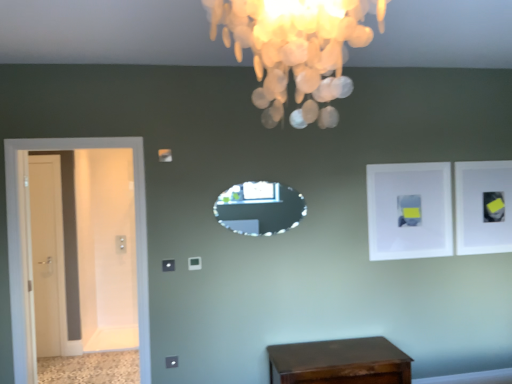
Measure the distance between crystal glass mirror at center and camera.

The distance of crystal glass mirror at center from camera is 10.09 feet.

Locate an element on the screen. The image size is (512, 384). crystal glass mirror at center is located at coordinates (260, 208).

The height and width of the screenshot is (384, 512). What do you see at coordinates (23, 235) in the screenshot?
I see `white glossy door at left, which appears as the first door when viewed from the right` at bounding box center [23, 235].

Where is `white matte picture frame at upper right, which is counted as the 1th picture frame, starting from the front`? This screenshot has width=512, height=384. white matte picture frame at upper right, which is counted as the 1th picture frame, starting from the front is located at coordinates (409, 210).

Where is `crystal glass mirror at center`? crystal glass mirror at center is located at coordinates (260, 208).

From the image's perspective, does ivory shell chandelier at upper center appear lower than white matte picture frame at upper right, placed as the 2th picture frame when sorted from right to left?

Incorrect, from the image's perspective, ivory shell chandelier at upper center is higher than white matte picture frame at upper right, placed as the 2th picture frame when sorted from right to left.

Between ivory shell chandelier at upper center and white matte picture frame at upper right, placed as the 2th picture frame when sorted from right to left, which one has more height?

With more height is white matte picture frame at upper right, placed as the 2th picture frame when sorted from right to left.

Measure the distance from ivory shell chandelier at upper center to white matte picture frame at upper right, placed as the 2th picture frame when sorted from right to left.

ivory shell chandelier at upper center is 2.46 meters away from white matte picture frame at upper right, placed as the 2th picture frame when sorted from right to left.

In the scene shown: Is ivory shell chandelier at upper center aimed at white matte picture frame at upper right, arranged as the 2th picture frame when viewed from the back?

No, ivory shell chandelier at upper center is not turned towards white matte picture frame at upper right, arranged as the 2th picture frame when viewed from the back.

Considering the relative sizes of white glossy door at left, which is counted as the second door, starting from the back, and white matte picture frame at upper right, which appears as the first picture frame when viewed from the left, in the image provided, is white glossy door at left, which is counted as the second door, starting from the back, taller than white matte picture frame at upper right, which appears as the first picture frame when viewed from the left,?

Yes.

Where is `door in front of the white matte picture frame at upper right, arranged as the 2th picture frame when viewed from the back`? door in front of the white matte picture frame at upper right, arranged as the 2th picture frame when viewed from the back is located at coordinates (23, 235).

Is white glossy door at left, which is counted as the first door, starting from the front, wider or thinner than white matte picture frame at upper right, which appears as the first picture frame when viewed from the left?

Considering their sizes, white glossy door at left, which is counted as the first door, starting from the front, looks broader than white matte picture frame at upper right, which appears as the first picture frame when viewed from the left.

Is white glossy door at left, which is counted as the first door, starting from the front, wider or thinner than white matte picture frame at upper right, which is the first picture frame from back to front?

Considering their sizes, white glossy door at left, which is counted as the first door, starting from the front, looks broader than white matte picture frame at upper right, which is the first picture frame from back to front.

Does point (12, 146) appear closer or farther from the camera than point (511, 230)?

Point (12, 146).

Looking at this image, which of these two, white glossy door at left, which appears as the first door when viewed from the right, or white matte picture frame at upper right, which is the 1th picture frame in right-to-left order, is bigger?

With larger size is white glossy door at left, which appears as the first door when viewed from the right.

Based on their positions, is white glossy door at left, the second door positioned from the left, located to the left or right of white matte picture frame at upper right, which is the 1th picture frame in right-to-left order?

From the image, it's evident that white glossy door at left, the second door positioned from the left, is to the left of white matte picture frame at upper right, which is the 1th picture frame in right-to-left order.

How far apart are shiny brown wooden table at lower center and white glossy door at left, the second door positioned from the left?

shiny brown wooden table at lower center and white glossy door at left, the second door positioned from the left, are 1.42 meters apart.

Can you confirm if shiny brown wooden table at lower center is wider than white glossy door at left, which is counted as the first door, starting from the front?

Yes, shiny brown wooden table at lower center is wider than white glossy door at left, which is counted as the first door, starting from the front.

Considering the relative positions of shiny brown wooden table at lower center and white glossy door at left, which appears as the first door when viewed from the right, in the image provided, is shiny brown wooden table at lower center to the left or to the right of white glossy door at left, which appears as the first door when viewed from the right,?

Based on their positions, shiny brown wooden table at lower center is located to the right of white glossy door at left, which appears as the first door when viewed from the right.

From the image's perspective, is shiny brown wooden table at lower center located above or below white glossy door at left, which appears as the first door when viewed from the right?

Based on their image positions, shiny brown wooden table at lower center is located beneath white glossy door at left, which appears as the first door when viewed from the right.

Which point is more forward, (6,195) or (322,59)?

The point (322,59) is more forward.

How many degrees apart are the facing directions of white glossy door at left, which is counted as the second door, starting from the back, and ivory shell chandelier at upper center?

They differ by 87.8 degrees in their facing directions.

Which is behind, white glossy door at left, which is counted as the first door, starting from the front, or ivory shell chandelier at upper center?

white glossy door at left, which is counted as the first door, starting from the front, is further away from the camera.

Considering the sizes of objects white glossy door at left, which appears as the first door when viewed from the right, and ivory shell chandelier at upper center in the image provided, who is bigger, white glossy door at left, which appears as the first door when viewed from the right, or ivory shell chandelier at upper center?

white glossy door at left, which appears as the first door when viewed from the right.

From the image's perspective, is ivory shell chandelier at upper center on shiny brown wooden table at lower center?

Yes, from the image's perspective, ivory shell chandelier at upper center is over shiny brown wooden table at lower center.

Locate an element on the screen. The height and width of the screenshot is (384, 512). lamp above the shiny brown wooden table at lower center (from the image's perspective) is located at coordinates (296, 50).

Is ivory shell chandelier at upper center positioned beyond the bounds of shiny brown wooden table at lower center?

That's correct, ivory shell chandelier at upper center is outside of shiny brown wooden table at lower center.

Based on the photo, from a real-world perspective, which is physically above, ivory shell chandelier at upper center or shiny brown wooden table at lower center?

From a 3D spatial view, ivory shell chandelier at upper center is above.

Based on the photo, how many degrees apart are the facing directions of white matte picture frame at upper right, which is the 1th picture frame in right-to-left order, and white glossy door at left, which appears as the first door when viewed from the right?

0.445 degrees.

Is white matte picture frame at upper right, which is the 1th picture frame in right-to-left order, not near white glossy door at left, the second door positioned from the left?

Absolutely, white matte picture frame at upper right, which is the 1th picture frame in right-to-left order, is distant from white glossy door at left, the second door positioned from the left.

Is white matte picture frame at upper right, which is the 1th picture frame in right-to-left order, positioned before white glossy door at left, which appears as the first door when viewed from the right?

No, white matte picture frame at upper right, which is the 1th picture frame in right-to-left order, is behind white glossy door at left, which appears as the first door when viewed from the right.

Between white matte picture frame at upper right, placed as the second picture frame when sorted from left to right, and white glossy door at left, which appears as the first door when viewed from the right, which one has smaller size?

white matte picture frame at upper right, placed as the second picture frame when sorted from left to right, is smaller.

The width and height of the screenshot is (512, 384). In order to click on lamp in front of the white matte picture frame at upper right, which appears as the first picture frame when viewed from the left in this screenshot , I will do `click(296, 50)`.

The image size is (512, 384). I want to click on door that is the 1st object to the left of the white matte picture frame at upper right, arranged as the 2th picture frame when viewed from the back, starting at the anchor, so click(x=23, y=235).

Looking at this image, considering their positions, is white glossy door at left, acting as the first door starting from the back, positioned closer to white matte picture frame at upper right, which is the 1th picture frame in right-to-left order, than shiny brown wooden table at lower center?

Based on the image, shiny brown wooden table at lower center appears to be nearer to white matte picture frame at upper right, which is the 1th picture frame in right-to-left order.

From the image, which object appears to be farther from ivory shell chandelier at upper center, white matte picture frame at upper right, placed as the second picture frame when sorted from left to right, or white glossy door at left, acting as the first door starting from the back?

white glossy door at left, acting as the first door starting from the back, lies further to ivory shell chandelier at upper center than the other object.

Based on the photo, considering their positions, is white matte picture frame at upper right, which is the 2th picture frame in front-to-back order, positioned further to shiny brown wooden table at lower center than crystal glass mirror at center?

white matte picture frame at upper right, which is the 2th picture frame in front-to-back order, lies further to shiny brown wooden table at lower center than the other object.

When comparing their distances from white glossy door at left, the second door in the right-to-left sequence, does ivory shell chandelier at upper center or white matte picture frame at upper right, which appears as the first picture frame when viewed from the left, seem closer?

The object closer to white glossy door at left, the second door in the right-to-left sequence, is white matte picture frame at upper right, which appears as the first picture frame when viewed from the left.

Based on their spatial positions, is shiny brown wooden table at lower center or crystal glass mirror at center further from white matte picture frame at upper right, which is the 1th picture frame in right-to-left order?

crystal glass mirror at center lies further to white matte picture frame at upper right, which is the 1th picture frame in right-to-left order, than the other object.

Based on their spatial positions, is white glossy door at left, marked as the second door in a front-to-back arrangement, or crystal glass mirror at center further from ivory shell chandelier at upper center?

white glossy door at left, marked as the second door in a front-to-back arrangement, lies further to ivory shell chandelier at upper center than the other object.

From the image, which object appears to be nearer to ivory shell chandelier at upper center, crystal glass mirror at center or white matte picture frame at upper right, which appears as the first picture frame when viewed from the left?

crystal glass mirror at center.

When comparing their distances from shiny brown wooden table at lower center, does crystal glass mirror at center or white glossy door at left, which is counted as the first door, starting from the front, seem further?

white glossy door at left, which is counted as the first door, starting from the front, lies further to shiny brown wooden table at lower center than the other object.

Locate an element on the screen. door between ivory shell chandelier at upper center and white glossy door at left, the second door in the right-to-left sequence, in the front-back direction is located at coordinates (23, 235).

What are the coordinates of `table between white glossy door at left, acting as the first door starting from the back, and white matte picture frame at upper right, which appears as the first picture frame when viewed from the left, in the horizontal direction` in the screenshot? It's located at (340, 362).

At what (x,y) coordinates should I click in order to perform the action: click on table between crystal glass mirror at center and white matte picture frame at upper right, which is the 1th picture frame in right-to-left order, in the horizontal direction. Please return your answer as a coordinate pair (x, y). Image resolution: width=512 pixels, height=384 pixels. Looking at the image, I should click on (340, 362).

This screenshot has height=384, width=512. Identify the location of door situated between white glossy door at left, the first door from the left, and white matte picture frame at upper right, which is the 1th picture frame in right-to-left order, from left to right. (23, 235).